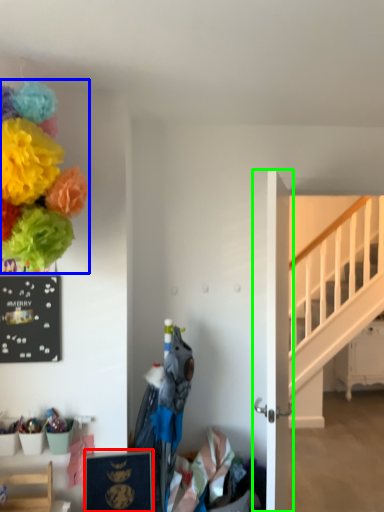
Question: Which is nearer to the picture frame (highlighted by a red box)? flower (highlighted by a blue box) or door (highlighted by a green box).

Choices:
 (A) flower
 (B) door

Answer: (B)